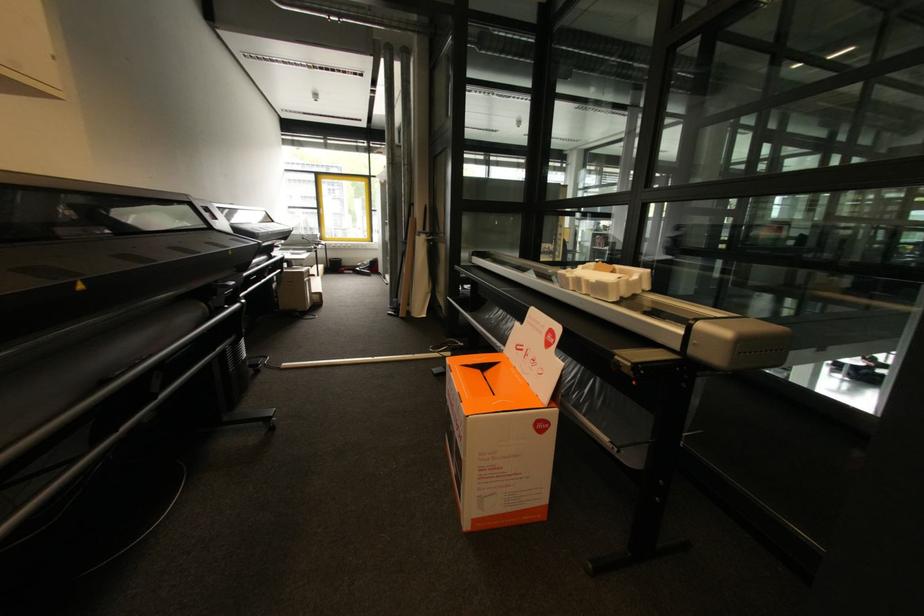
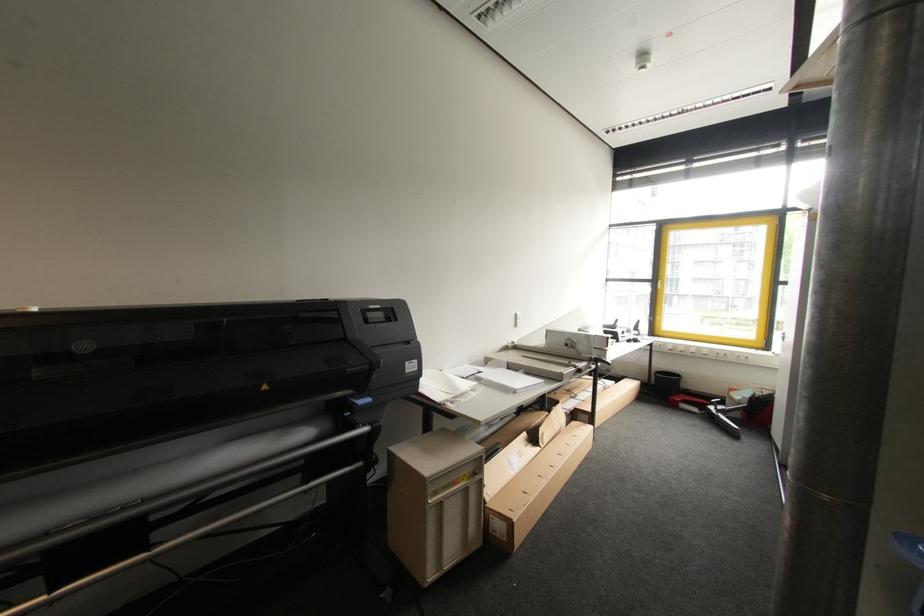
Where in the second image is the point corresponding to (355,273) from the first image?

(699, 411)